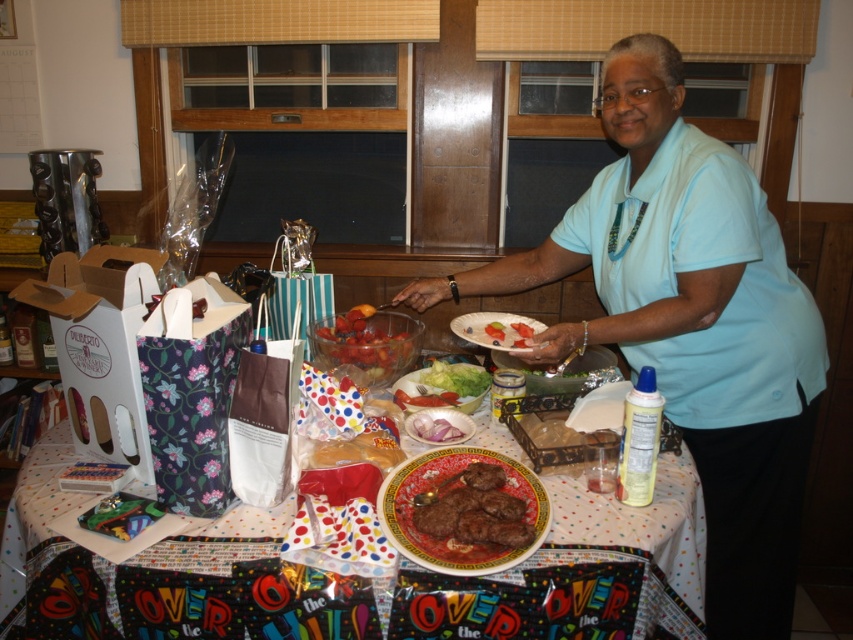
Question: Which object appears farthest from the camera in this image?

Choices:
 (A) white matte plate at center
 (B) shiny plastic bowl at center
 (C) pink paper napkin at center
 (D) brown matte meatballs at center

Answer: (B)

Question: Where is brown matte meatballs at center located in relation to shiny plastic bowl at center in the image?

Choices:
 (A) above
 (B) below

Answer: (B)

Question: In this image, where is light blue shirt at center located relative to shiny plastic bowl at center?

Choices:
 (A) below
 (B) above

Answer: (A)

Question: Considering the real-world distances, which object is closest to the white matte plate at center?

Choices:
 (A) polka dot tablecloth at lower center
 (B) pink paper napkin at center
 (C) shiny plastic bowl at center
 (D) brown matte meatballs at center

Answer: (C)

Question: Which is nearer to the green leafy lettuce at center?

Choices:
 (A) pink paper napkin at center
 (B) polka dot tablecloth at lower center
 (C) brown matte meatballs at center

Answer: (A)

Question: Observing the image, what is the correct spatial positioning of light blue shirt at center in reference to pink paper napkin at center?

Choices:
 (A) below
 (B) above

Answer: (B)